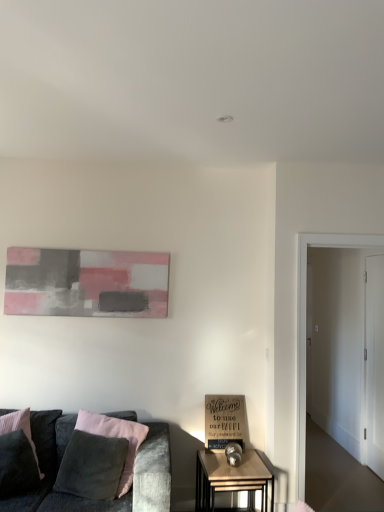
Where is `vacant space that is to the left of white glossy door at right, which is the first glass door in right-to-left order`? This screenshot has height=512, width=384. vacant space that is to the left of white glossy door at right, which is the first glass door in right-to-left order is located at coordinates (335, 468).